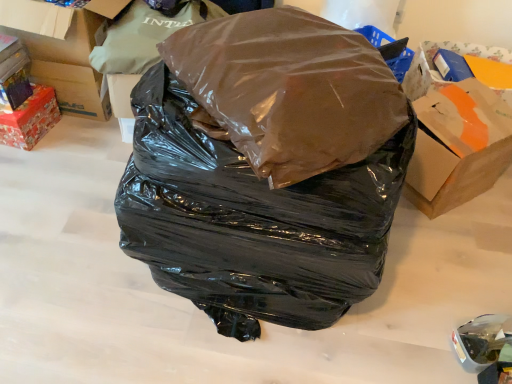
Looking at this image, how much space does brown matte plastic bag at center, placed as the 1th plastic bag when sorted from bottom to top, occupy horizontally?

brown matte plastic bag at center, placed as the 1th plastic bag when sorted from bottom to top, is 28.93 inches wide.

What do you see at coordinates (13, 73) in the screenshot? I see `matte cardboard box at upper left` at bounding box center [13, 73].

The width and height of the screenshot is (512, 384). What do you see at coordinates (139, 38) in the screenshot? I see `brown matte plastic bag at upper center, the first plastic bag viewed from the top` at bounding box center [139, 38].

In order to face brown matte plastic bag at upper center, the first plastic bag viewed from the top, should I rotate leftwards or rightwards?

Rotate your view left by about 10.134°.

The height and width of the screenshot is (384, 512). What do you see at coordinates (70, 65) in the screenshot?
I see `matte cardboard box at left, placed as the first box when sorted from top to bottom` at bounding box center [70, 65].

Where is `shiny metallic box at left, the first box in the bottom-to-top sequence`? The height and width of the screenshot is (384, 512). shiny metallic box at left, the first box in the bottom-to-top sequence is located at coordinates (30, 119).

Considering the sizes of objects brown cardboard box at right and matte cardboard box at upper left in the image provided, who is shorter, brown cardboard box at right or matte cardboard box at upper left?

matte cardboard box at upper left.

From the image's perspective, is brown cardboard box at right under matte cardboard box at upper left?

Yes, from the image's perspective, brown cardboard box at right is below matte cardboard box at upper left.

At what (x,y) coordinates should I click in order to perform the action: click on cardboard box lying below the matte cardboard box at upper left (from the image's perspective). Please return your answer as a coordinate pair (x, y). Image resolution: width=512 pixels, height=384 pixels. Looking at the image, I should click on (458, 159).

Measure the distance from brown matte plastic bag at center, which is counted as the 3th plastic bag, starting from the top, to brown matte plastic bag at center, which is the 2th plastic bag in top-to-bottom order.

brown matte plastic bag at center, which is counted as the 3th plastic bag, starting from the top, and brown matte plastic bag at center, which is the 2th plastic bag in top-to-bottom order, are 25.09 centimeters apart from each other.

Would you consider brown matte plastic bag at center, placed as the 1th plastic bag when sorted from bottom to top, to be distant from brown matte plastic bag at center, which is the 2th plastic bag in top-to-bottom order?

No, there isn't a large distance between brown matte plastic bag at center, placed as the 1th plastic bag when sorted from bottom to top, and brown matte plastic bag at center, which is the 2th plastic bag in top-to-bottom order.

At what (x,y) coordinates should I click in order to perform the action: click on plastic bag that is the 1st one when counting leftward from the brown matte plastic bag at center, which is the 2th plastic bag in top-to-bottom order. Please return your answer as a coordinate pair (x, y). Looking at the image, I should click on (251, 220).

Is brown matte plastic bag at center, which is the 2th plastic bag in top-to-bottom order, at the back of brown matte plastic bag at center, placed as the 1th plastic bag when sorted from bottom to top?

brown matte plastic bag at center, placed as the 1th plastic bag when sorted from bottom to top, is not turned away from brown matte plastic bag at center, which is the 2th plastic bag in top-to-bottom order.

From the picture: Considering the sizes of brown matte plastic bag at upper center, the first plastic bag viewed from the top, and brown matte plastic bag at center, which is the 2th plastic bag in top-to-bottom order, in the image, is brown matte plastic bag at upper center, the first plastic bag viewed from the top, taller or shorter than brown matte plastic bag at center, which is the 2th plastic bag in top-to-bottom order,?

Clearly, brown matte plastic bag at upper center, the first plastic bag viewed from the top, is taller compared to brown matte plastic bag at center, which is the 2th plastic bag in top-to-bottom order.

Is brown matte plastic bag at upper center, the third plastic bag when ordered from bottom to top, at the right side of brown matte plastic bag at center, which is counted as the 2th plastic bag, starting from the bottom?

No.

From the image's perspective, between brown matte plastic bag at upper center, the first plastic bag viewed from the top, and brown matte plastic bag at center, which is counted as the 2th plastic bag, starting from the bottom, which one is located above?

brown matte plastic bag at upper center, the first plastic bag viewed from the top, is shown above in the image.

Identify the location of plastic bag located above the brown matte plastic bag at center, which is counted as the 2th plastic bag, starting from the bottom (from the image's perspective). (139, 38).

Which of these two, matte cardboard box at upper left or brown matte plastic bag at center, which is counted as the 2th plastic bag, starting from the bottom, is wider?

brown matte plastic bag at center, which is counted as the 2th plastic bag, starting from the bottom.

Is matte cardboard box at upper left taller or shorter than brown matte plastic bag at center, which is counted as the 2th plastic bag, starting from the bottom?

In the image, matte cardboard box at upper left appears to be shorter than brown matte plastic bag at center, which is counted as the 2th plastic bag, starting from the bottom.

You are a GUI agent. You are given a task and a screenshot of the screen. Output one action in this format:
    pyautogui.click(x=<x>, y=<y>)
    Task: Click on the storage box that appears behind the brown matte plastic bag at center, which is counted as the 2th plastic bag, starting from the bottom
    This screenshot has width=512, height=384.
    Given the screenshot: What is the action you would take?
    pyautogui.click(x=13, y=73)

Between point (6, 79) and point (310, 25), which one is positioned in front?

The point (310, 25) is more forward.

Which of these two, brown matte plastic bag at upper center, the third plastic bag when ordered from bottom to top, or brown cardboard box at right, is wider?

brown matte plastic bag at upper center, the third plastic bag when ordered from bottom to top, is wider.

Considering the positions of objects brown matte plastic bag at upper center, the first plastic bag viewed from the top, and brown cardboard box at right in the image provided, who is more to the right, brown matte plastic bag at upper center, the first plastic bag viewed from the top, or brown cardboard box at right?

Positioned to the right is brown cardboard box at right.

Choose the correct answer: Is brown matte plastic bag at upper center, the third plastic bag when ordered from bottom to top, inside brown cardboard box at right or outside it?

The correct answer is: outside.

I want to click on plastic bag behind the brown cardboard box at right, so click(139, 38).

Measure the distance between matte cardboard box at upper left and shiny metallic box at left, acting as the 2th box starting from the top.

matte cardboard box at upper left is 4.17 inches from shiny metallic box at left, acting as the 2th box starting from the top.

Considering the sizes of objects matte cardboard box at upper left and shiny metallic box at left, acting as the 2th box starting from the top, in the image provided, who is shorter, matte cardboard box at upper left or shiny metallic box at left, acting as the 2th box starting from the top,?

matte cardboard box at upper left.

Which object is more forward, matte cardboard box at upper left or shiny metallic box at left, acting as the 2th box starting from the top?

matte cardboard box at upper left is more forward.

Is matte cardboard box at upper left not inside shiny metallic box at left, the first box in the bottom-to-top sequence?

Indeed, matte cardboard box at upper left is completely outside shiny metallic box at left, the first box in the bottom-to-top sequence.

From the picture: In terms of size, does shiny metallic box at left, the first box in the bottom-to-top sequence, appear bigger or smaller than brown cardboard box at right?

Considering their sizes, shiny metallic box at left, the first box in the bottom-to-top sequence, takes up less space than brown cardboard box at right.

Looking at their sizes, would you say shiny metallic box at left, acting as the 2th box starting from the top, is wider or thinner than brown cardboard box at right?

Clearly, shiny metallic box at left, acting as the 2th box starting from the top, has less width compared to brown cardboard box at right.

Considering the points (33, 125) and (411, 173), which point is behind, point (33, 125) or point (411, 173)?

The point (33, 125) is more distant.

Is shiny metallic box at left, the first box in the bottom-to-top sequence, in front of brown cardboard box at right?

No, the depth of shiny metallic box at left, the first box in the bottom-to-top sequence, is greater than that of brown cardboard box at right.

The image size is (512, 384). I want to click on cardboard box that is on the right side of matte cardboard box at upper left, so click(x=458, y=159).

There is a brown matte plastic bag at center, placed as the 1th plastic bag when sorted from bottom to top. In order to click on the 2nd plastic bag above it (from a real-world perspective) in this screenshot , I will do `click(289, 90)`.

Considering their positions, is brown matte plastic bag at center, which is the 2th plastic bag in top-to-bottom order, positioned further to brown matte plastic bag at center, placed as the 1th plastic bag when sorted from bottom to top, than matte cardboard box at left, placed as the first box when sorted from top to bottom?

The object further to brown matte plastic bag at center, placed as the 1th plastic bag when sorted from bottom to top, is matte cardboard box at left, placed as the first box when sorted from top to bottom.

From the image, which object appears to be farther from shiny metallic box at left, the first box in the bottom-to-top sequence, matte cardboard box at upper left or matte cardboard box at left, placed as the first box when sorted from top to bottom?

The object further to shiny metallic box at left, the first box in the bottom-to-top sequence, is matte cardboard box at left, placed as the first box when sorted from top to bottom.

From the image, which object appears to be farther from brown matte plastic bag at center, placed as the 1th plastic bag when sorted from bottom to top, shiny metallic box at left, the first box in the bottom-to-top sequence, or matte cardboard box at upper left?

matte cardboard box at upper left is positioned further to the anchor brown matte plastic bag at center, placed as the 1th plastic bag when sorted from bottom to top.

Consider the image. Which object lies further to the anchor point matte cardboard box at upper left, brown matte plastic bag at upper center, the first plastic bag viewed from the top, or matte cardboard box at left, the 2th box in the bottom-to-top sequence?

brown matte plastic bag at upper center, the first plastic bag viewed from the top, lies further to matte cardboard box at upper left than the other object.

Considering their positions, is brown cardboard box at right positioned closer to matte cardboard box at upper left than brown matte plastic bag at center, which is counted as the 3th plastic bag, starting from the top?

The object closer to matte cardboard box at upper left is brown matte plastic bag at center, which is counted as the 3th plastic bag, starting from the top.

Looking at the image, which one is located closer to shiny metallic box at left, the first box in the bottom-to-top sequence, matte cardboard box at upper left or brown matte plastic bag at upper center, the first plastic bag viewed from the top?

matte cardboard box at upper left is positioned closer to the anchor shiny metallic box at left, the first box in the bottom-to-top sequence.

Which object lies nearer to the anchor point shiny metallic box at left, the first box in the bottom-to-top sequence, matte cardboard box at upper left or brown cardboard box at right?

matte cardboard box at upper left is closer to shiny metallic box at left, the first box in the bottom-to-top sequence.

Looking at the image, which one is located closer to matte cardboard box at upper left, matte cardboard box at left, placed as the first box when sorted from top to bottom, or brown matte plastic bag at upper center, the third plastic bag when ordered from bottom to top?

matte cardboard box at left, placed as the first box when sorted from top to bottom, is positioned closer to the anchor matte cardboard box at upper left.

Find the location of `plastic bag between shiny metallic box at left, the first box in the bottom-to-top sequence, and brown matte plastic bag at center, which is counted as the 3th plastic bag, starting from the top, in the horizontal direction`. plastic bag between shiny metallic box at left, the first box in the bottom-to-top sequence, and brown matte plastic bag at center, which is counted as the 3th plastic bag, starting from the top, in the horizontal direction is located at coordinates (139, 38).

Where is `storage box between matte cardboard box at left, the 2th box in the bottom-to-top sequence, and shiny metallic box at left, the first box in the bottom-to-top sequence, vertically`? storage box between matte cardboard box at left, the 2th box in the bottom-to-top sequence, and shiny metallic box at left, the first box in the bottom-to-top sequence, vertically is located at coordinates (13, 73).

Image resolution: width=512 pixels, height=384 pixels. Find the location of `storage box located between shiny metallic box at left, acting as the 2th box starting from the top, and brown matte plastic bag at upper center, the first plastic bag viewed from the top, in the left-right direction`. storage box located between shiny metallic box at left, acting as the 2th box starting from the top, and brown matte plastic bag at upper center, the first plastic bag viewed from the top, in the left-right direction is located at coordinates (13, 73).

I want to click on box located between shiny metallic box at left, acting as the 2th box starting from the top, and brown matte plastic bag at center, which is counted as the 3th plastic bag, starting from the top, in the left-right direction, so click(70, 65).